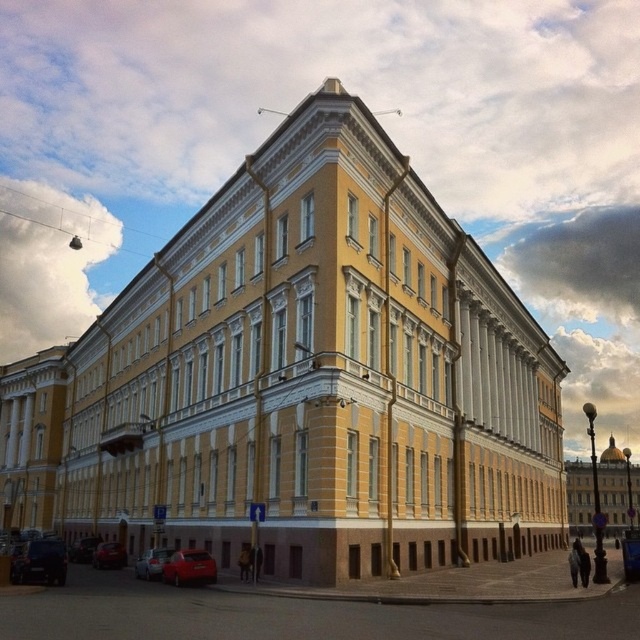
Does point (93, 566) lie behind point (81, 561)?

No, (93, 566) is closer to viewer.

Who is more forward, (125, 552) or (74, 541)?

Point (125, 552)

Which is in front, point (93, 548) or point (70, 560)?

Point (93, 548)

The image size is (640, 640). In order to click on shiny red car at lower left in this screenshot , I will do `click(109, 556)`.

Who is higher up, yellow stone building at center or metallic red car at lower left?

metallic red car at lower left is higher up.

Which is behind, point (636, 509) or point (72, 557)?

The point (636, 509) is behind.

Who is more forward, (589, 492) or (74, 545)?

Point (74, 545)

You are a GUI agent. You are given a task and a screenshot of the screen. Output one action in this format:
    pyautogui.click(x=<x>, y=<y>)
    Task: Click on the yellow stone building at center
    This screenshot has width=640, height=640.
    Given the screenshot: What is the action you would take?
    pyautogui.click(x=612, y=492)

Is point (340, 125) behind point (154, 550)?

No, (340, 125) is in front of (154, 550).

Can you confirm if yellow brick building at center is positioned above matte red car at lower left?

Yes, yellow brick building at center is above matte red car at lower left.

Is point (282, 278) positioned behind point (154, 550)?

No, it is not.

Where is `yellow brick building at center`? This screenshot has width=640, height=640. yellow brick building at center is located at coordinates (301, 380).